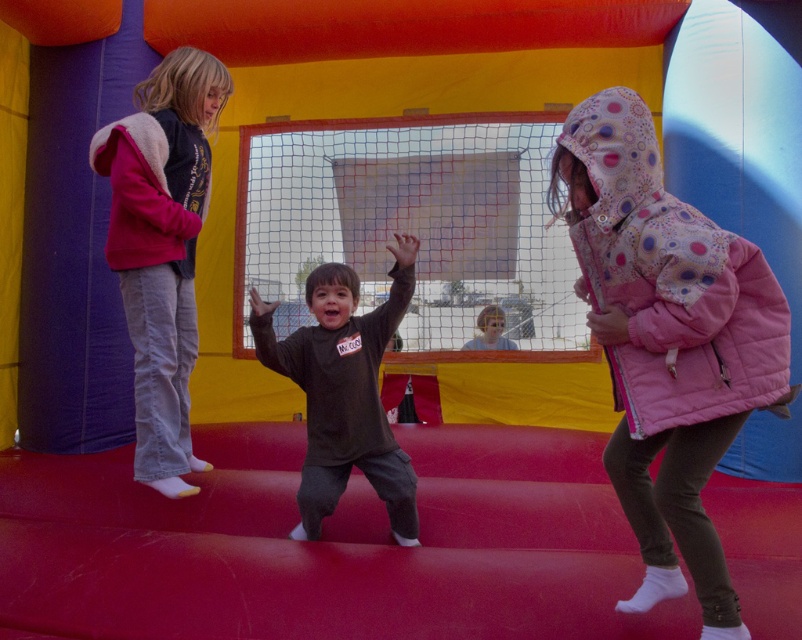
Question: Can you confirm if light pink fleece jacket at left is bigger than dark gray fleece shirt at center?

Choices:
 (A) no
 (B) yes

Answer: (B)

Question: Which point appears closest to the camera in this image?

Choices:
 (A) (406, 458)
 (B) (120, 150)

Answer: (B)

Question: Estimate the real-world distances between objects in this image. Which object is farther from the pink quilted jacket at right?

Choices:
 (A) pink fleece jacket at upper left
 (B) dark gray fleece shirt at center
 (C) light pink fleece jacket at left

Answer: (C)

Question: Is light pink fleece jacket at left smaller than pink fleece jacket at upper left?

Choices:
 (A) yes
 (B) no

Answer: (B)

Question: Can you confirm if dark gray fleece shirt at center is positioned to the right of pink fleece jacket at upper left?

Choices:
 (A) yes
 (B) no

Answer: (A)

Question: Among these points, which one is farthest from the camera?

Choices:
 (A) [x=196, y=195]
 (B) [x=323, y=496]
 (C) [x=195, y=209]

Answer: (C)